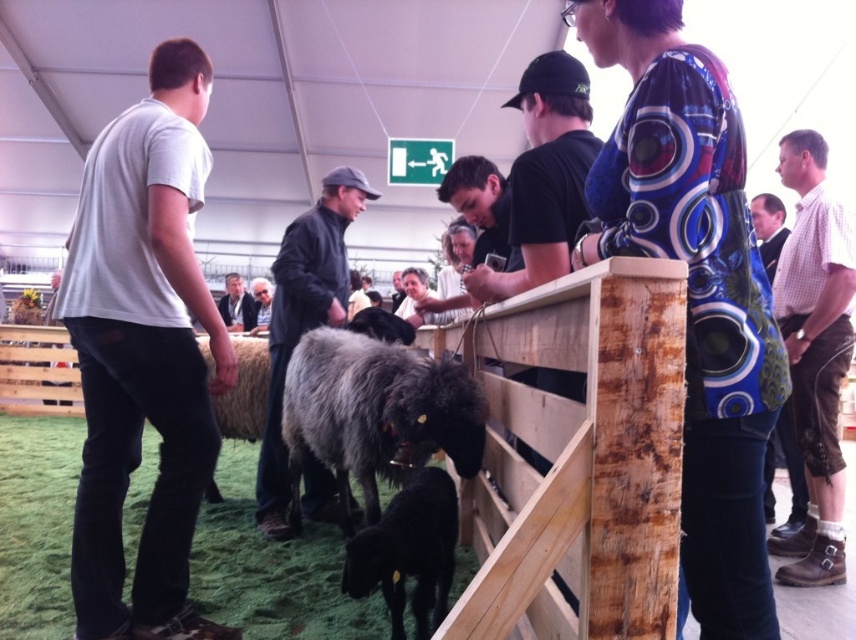
Question: Estimate the real-world distances between objects in this image. Which object is farther from the black leather jacket at upper center?

Choices:
 (A) fluffy woolen sheep at center
 (B) light brown leather jacket at upper right

Answer: (A)

Question: Is dark gray leather jacket at center below blue fabric bag at right?

Choices:
 (A) yes
 (B) no

Answer: (B)

Question: Does fluffy woolen sheep at center come in front of gray woolen jacket at center?

Choices:
 (A) yes
 (B) no

Answer: (A)

Question: Where is checkered shirt at right located in relation to light brown leather jacket at upper right in the image?

Choices:
 (A) right
 (B) left

Answer: (B)

Question: Estimate the real-world distances between objects in this image. Which object is farther from the white matte shirt at left?

Choices:
 (A) fluffy woolen sheep at center
 (B) blue fabric bag at right

Answer: (B)

Question: Which point appears farthest from the camera in this image?

Choices:
 (A) (260, 419)
 (B) (92, 467)
 (C) (770, 225)
 (D) (336, 234)

Answer: (A)